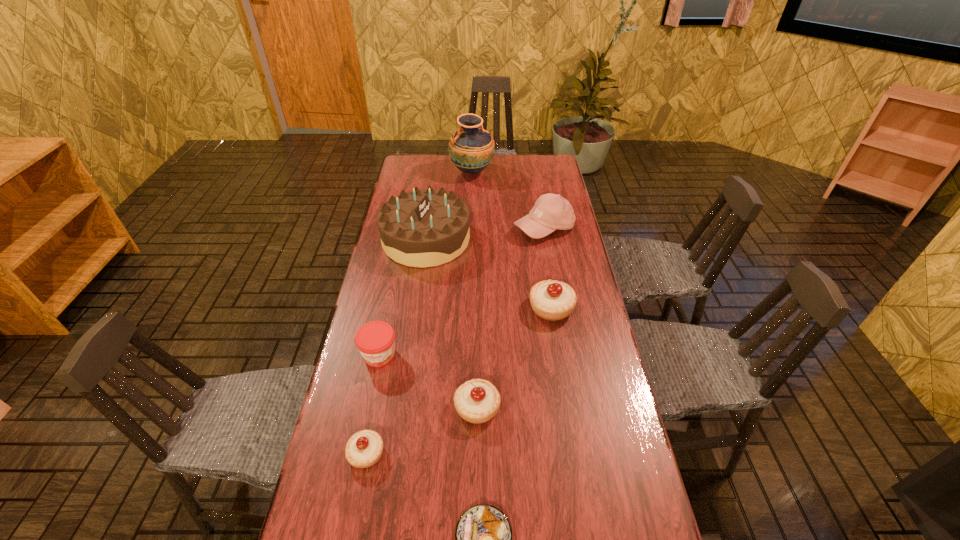
Image resolution: width=960 pixels, height=540 pixels. In order to click on the closest beige pastry to the second beige pastry from right to left in this screenshot , I will do `click(364, 448)`.

Identify the location of the closest beige pastry to the third shortest pastry. (364, 448).

The height and width of the screenshot is (540, 960). What are the coordinates of `free spot that satisfies the following two spatial constraints: 1. on the label side of the nearest beige pastry; 2. on the left side of the red jam` in the screenshot? It's located at (359, 454).

Where is `free space that satisfies the following two spatial constraints: 1. on the front-facing side of the seventh shortest object; 2. on the back side of the biggest beige pastry`? The image size is (960, 540). free space that satisfies the following two spatial constraints: 1. on the front-facing side of the seventh shortest object; 2. on the back side of the biggest beige pastry is located at coordinates (416, 308).

At what (x,y) coordinates should I click in order to perform the action: click on vacant area in the image that satisfies the following two spatial constraints: 1. on the front-facing side of the second tallest object; 2. on the label side of the fifth farthest object. Please return your answer as a coordinate pair (x, y). The height and width of the screenshot is (540, 960). Looking at the image, I should click on (409, 355).

At what (x,y) coordinates should I click in order to perform the action: click on vacant space that satisfies the following two spatial constraints: 1. on the front-facing side of the birthday cake; 2. on the left side of the biggest beige pastry. Please return your answer as a coordinate pair (x, y). This screenshot has width=960, height=540. Looking at the image, I should click on point(416,308).